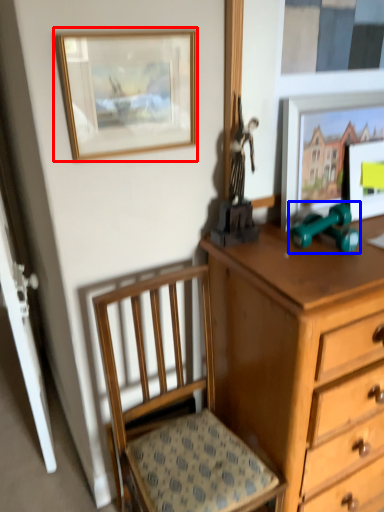
Question: Which object is closer to the camera taking this photo, picture frame (highlighted by a red box) or toy (highlighted by a blue box)?

Choices:
 (A) picture frame
 (B) toy

Answer: (A)